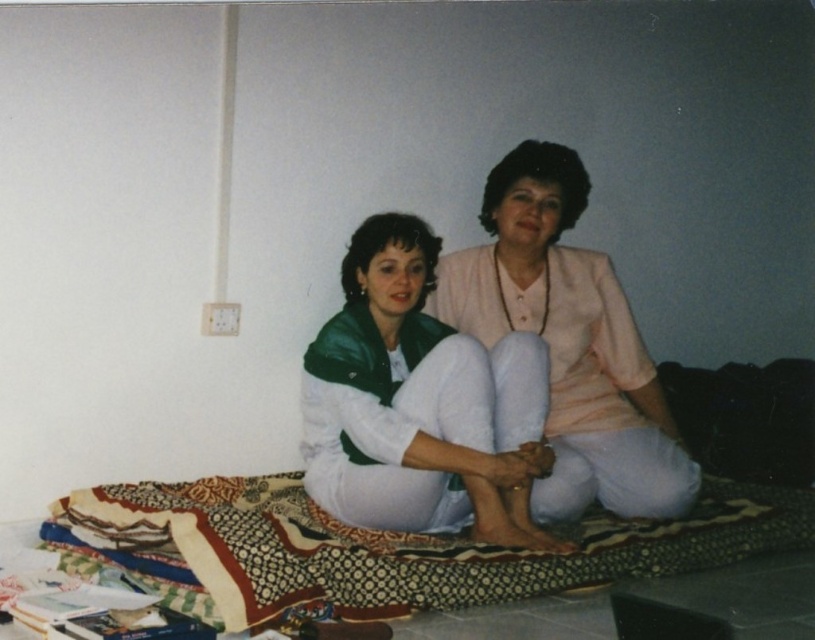
Question: Which point is farther to the camera?

Choices:
 (A) matte pink blouse at center
 (B) patterned fabric blanket at center
 (C) light pink fabric at center

Answer: (C)

Question: Can you confirm if matte pink blouse at center is positioned above light pink fabric at center?

Choices:
 (A) no
 (B) yes

Answer: (A)

Question: Which point is farther to the camera?

Choices:
 (A) patterned fabric blanket at center
 (B) light pink fabric at center

Answer: (B)

Question: Can you confirm if matte pink blouse at center is bigger than light pink fabric at center?

Choices:
 (A) yes
 (B) no

Answer: (B)

Question: Does patterned fabric blanket at center have a greater width compared to light pink fabric at center?

Choices:
 (A) no
 (B) yes

Answer: (B)

Question: Which point is closer to the camera taking this photo?

Choices:
 (A) (476, 314)
 (B) (341, 404)

Answer: (B)